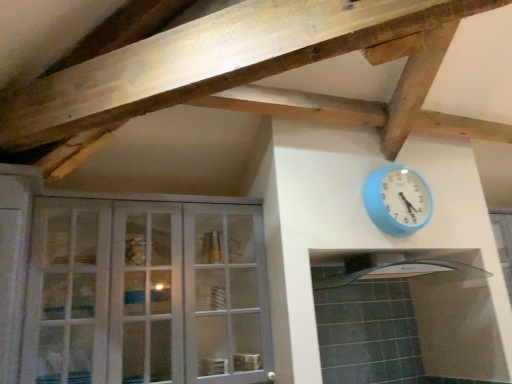
Question: From the image's perspective, is blue plastic wall clock at upper right above or below white glass cabinet at left?

Choices:
 (A) below
 (B) above

Answer: (B)

Question: Considering their positions, is blue plastic wall clock at upper right located in front of or behind white glass cabinet at left?

Choices:
 (A) front
 (B) behind

Answer: (B)

Question: Which object is the farthest from the white glass cabinet at left?

Choices:
 (A) blue plastic wall clock at upper right
 (B) clear glass exhaust hood at center

Answer: (A)

Question: Estimate the real-world distances between objects in this image. Which object is closer to the white glass cabinet at left?

Choices:
 (A) clear glass exhaust hood at center
 (B) blue plastic wall clock at upper right

Answer: (A)